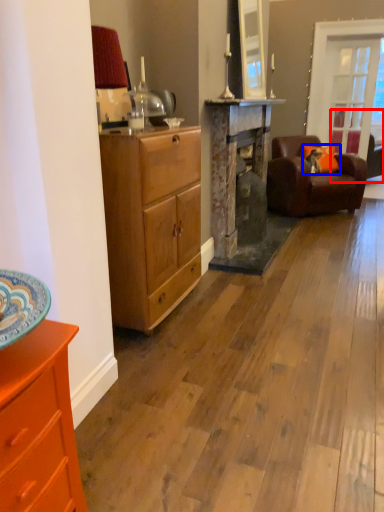
Question: Among these objects, which one is nearest to the camera, studio couch (highlighted by a red box) or pillow (highlighted by a blue box)?

Choices:
 (A) studio couch
 (B) pillow

Answer: (B)